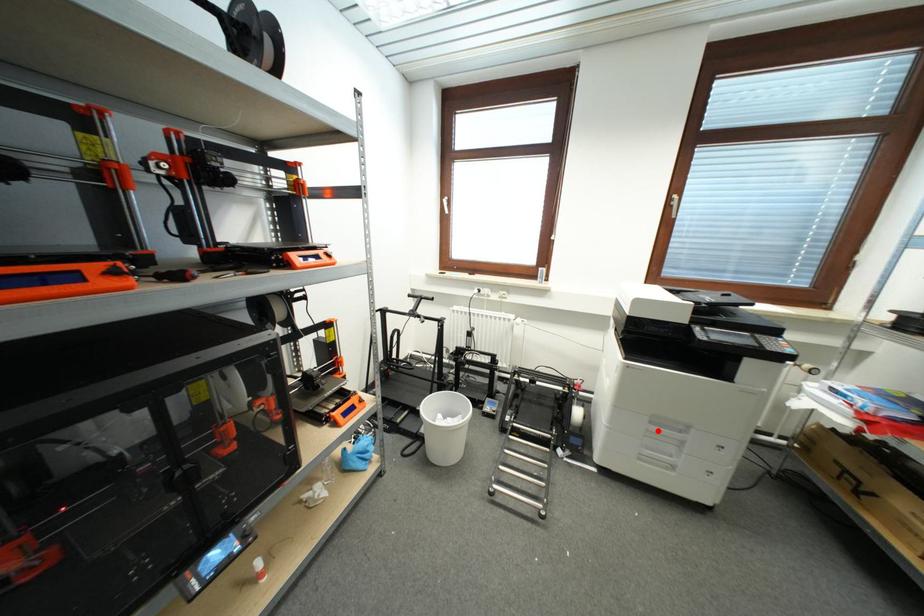
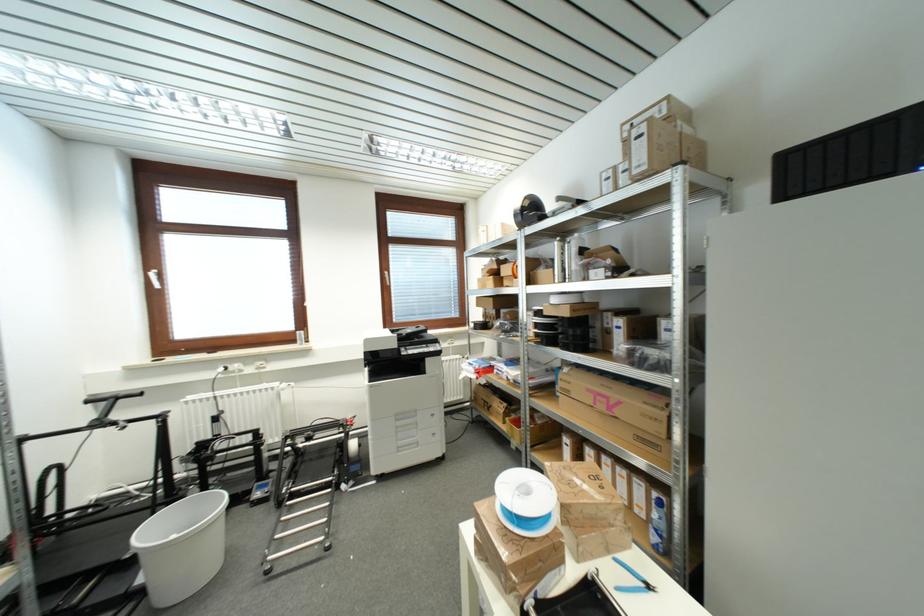
Where in the second image is the point corresponding to the highlighted location from the first image?

(404, 426)